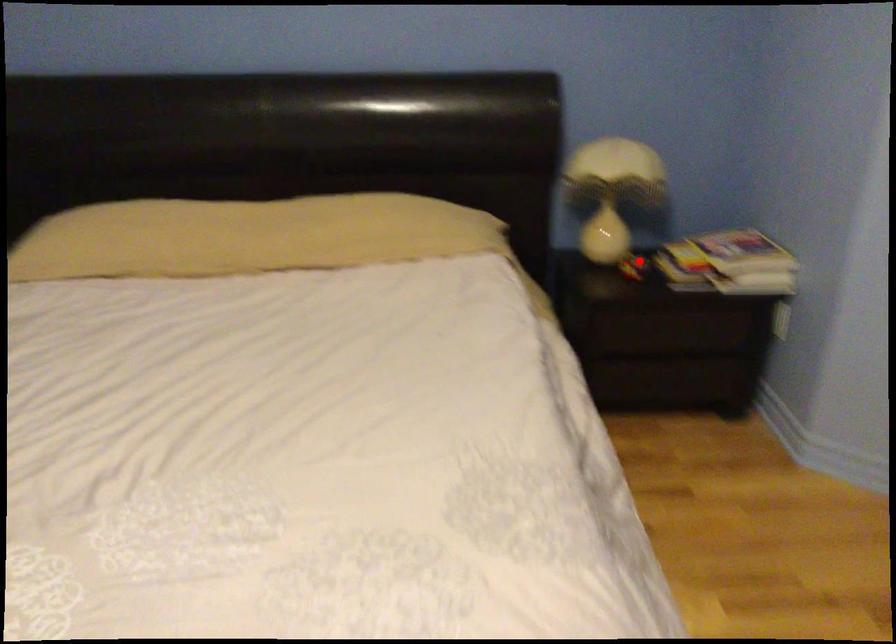
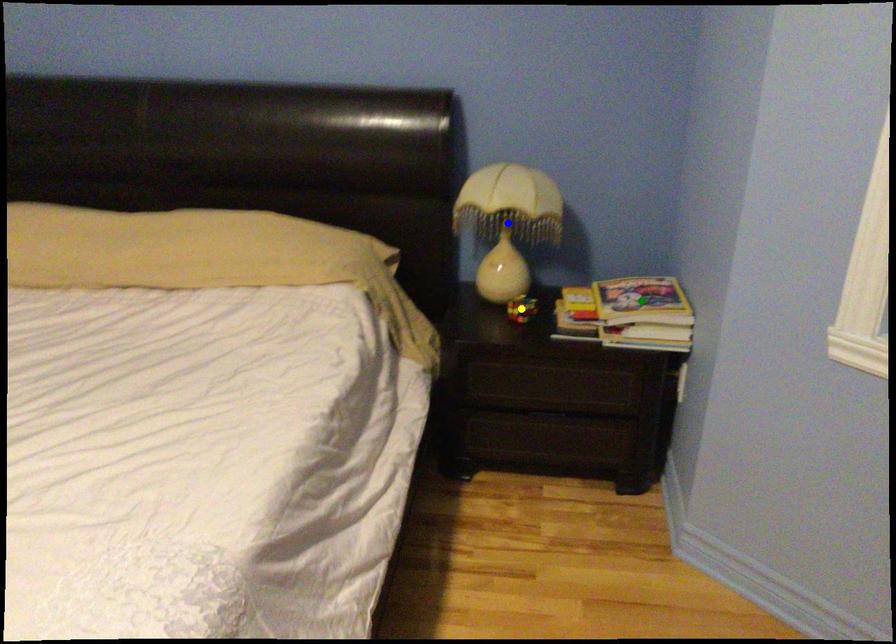
Question: I am providing you with two images of the same scene from different viewpoints. A red point is marked on the first image. You are given multiple points on the second image. Which point in image 2 is actually the same real-world point as the red point in image 1?

Choices:
 (A) green point
 (B) blue point
 (C) yellow point

Answer: (C)